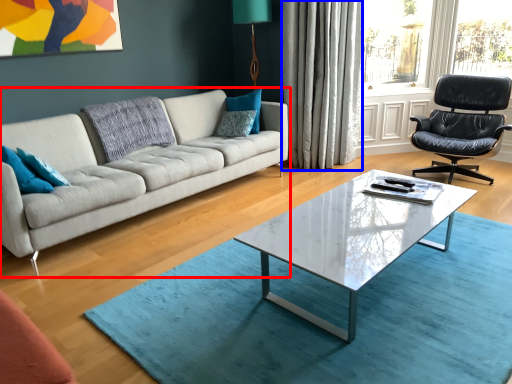
Question: Which object is closer to the camera taking this photo, studio couch (highlighted by a red box) or curtain (highlighted by a blue box)?

Choices:
 (A) studio couch
 (B) curtain

Answer: (A)